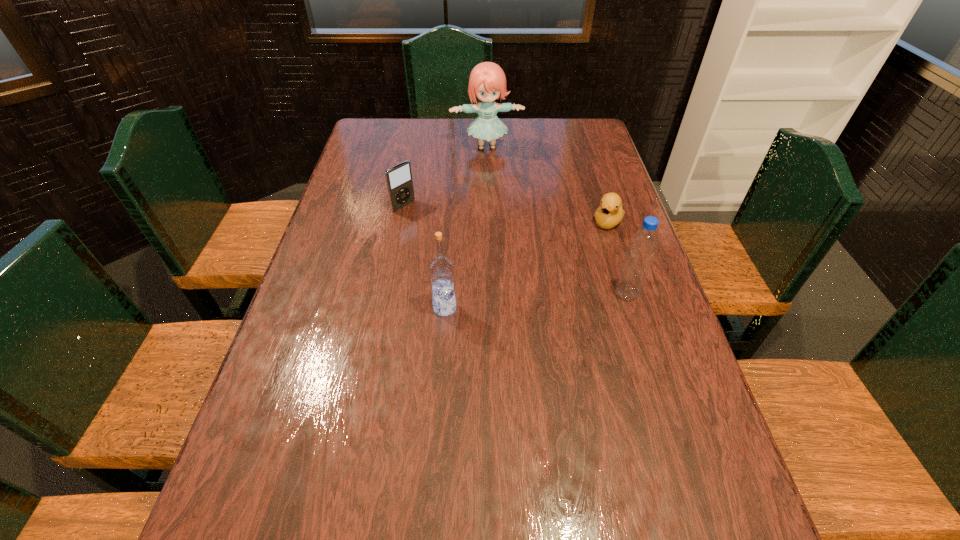
You are a GUI agent. You are given a task and a screenshot of the screen. Output one action in this format:
    pyautogui.click(x=<x>, y=<y>)
    Task: Click on the vodka
    The width and height of the screenshot is (960, 540).
    Given the screenshot: What is the action you would take?
    pyautogui.click(x=441, y=268)

Find the location of a particular element. water bottle is located at coordinates (642, 246).

The image size is (960, 540). I want to click on the tallest object, so click(x=487, y=82).

This screenshot has width=960, height=540. What are the coordinates of `doll` in the screenshot? It's located at (487, 82).

You are a GUI agent. You are given a task and a screenshot of the screen. Output one action in this format:
    pyautogui.click(x=<x>, y=<y>)
    Task: Click on the duckling
    Image resolution: width=960 pixels, height=540 pixels.
    Given the screenshot: What is the action you would take?
    pyautogui.click(x=610, y=212)

The image size is (960, 540). What are the coordinates of `the fourth tallest object` in the screenshot? It's located at (399, 182).

Locate an element on the screen. the leftmost object is located at coordinates (399, 182).

Locate an element on the screen. The height and width of the screenshot is (540, 960). free spot located on the left of the vodka is located at coordinates (380, 308).

Locate an element on the screen. free space located 0.070m on the front of the water bottle is located at coordinates (636, 326).

Identify the location of vacant space located on the front-facing side of the doll. The width and height of the screenshot is (960, 540). (492, 171).